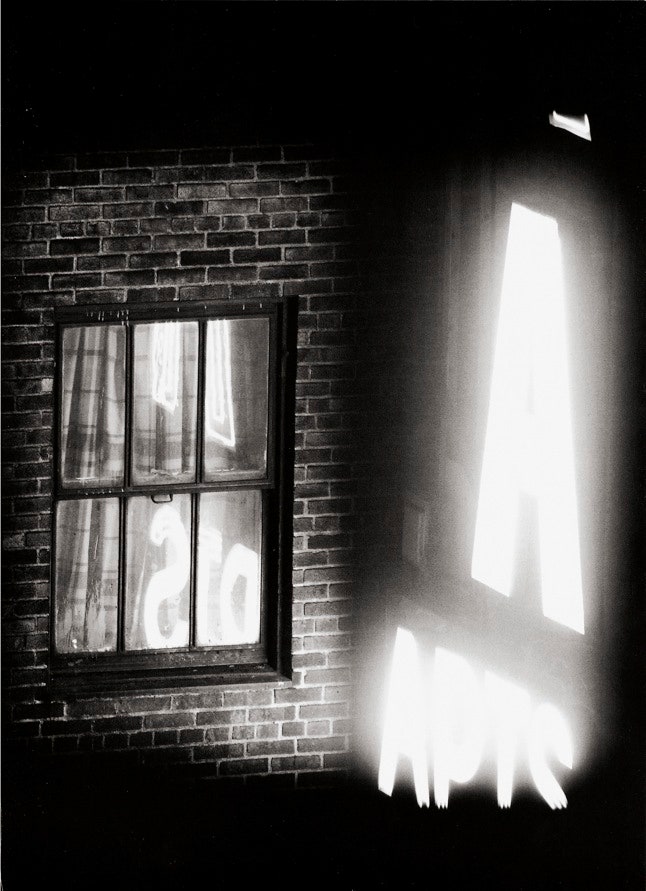
Locate an element on the screen. brick wall is located at coordinates (183, 716), (325, 435).